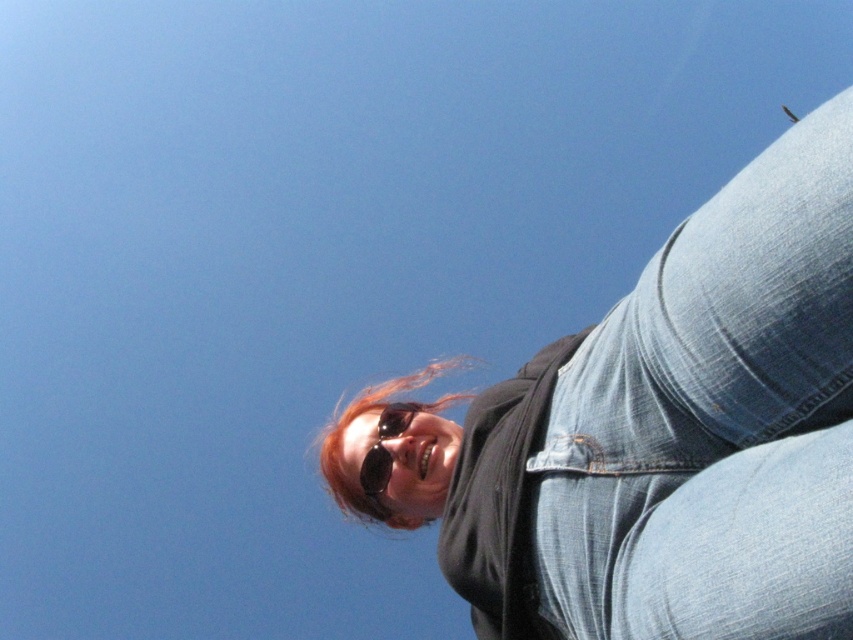
Question: Among these points, which one is farthest from the camera?

Choices:
 (A) (370, 493)
 (B) (430, 410)
 (C) (840, 195)

Answer: (B)

Question: Which point is closer to the camera?

Choices:
 (A) black reflective sunglasses at center
 (B) denim at right

Answer: (B)

Question: Is blonde hair at center to the right of black reflective sunglasses at center from the viewer's perspective?

Choices:
 (A) yes
 (B) no

Answer: (B)

Question: Is blonde hair at center above black reflective sunglasses at center?

Choices:
 (A) yes
 (B) no

Answer: (B)

Question: Which of these objects is positioned farthest from the black reflective sunglasses at center?

Choices:
 (A) denim at right
 (B) blonde hair at center

Answer: (B)

Question: In this image, where is denim at right located relative to black reflective sunglasses at center?

Choices:
 (A) left
 (B) right

Answer: (B)